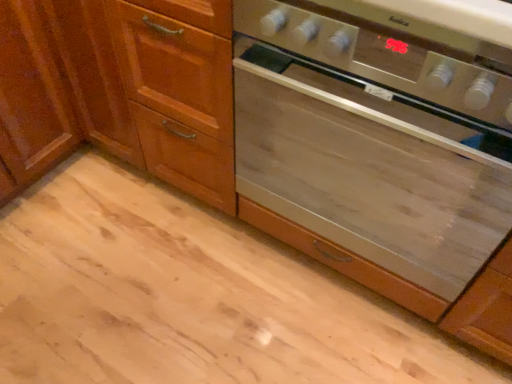
Identify the location of wooden panel oven at center. This screenshot has width=512, height=384. (370, 151).

Describe the element at coordinates (370, 151) in the screenshot. I see `wooden panel oven at center` at that location.

Where is `wooden panel oven at center`? The image size is (512, 384). wooden panel oven at center is located at coordinates (370, 151).